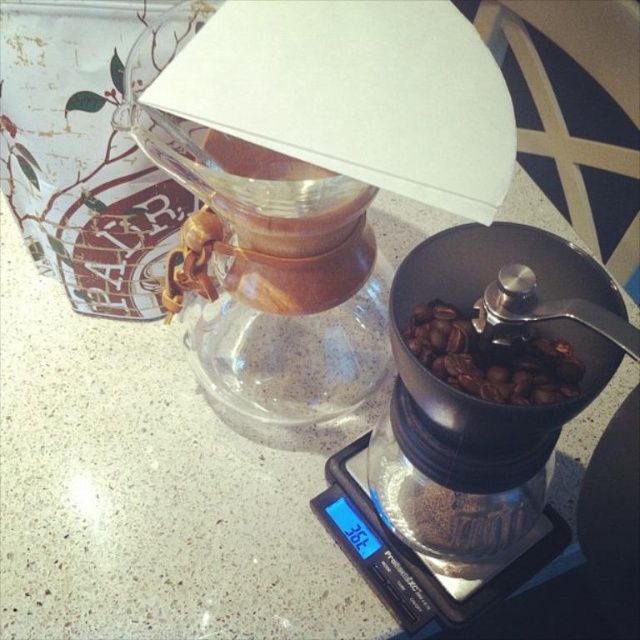
You are setting up a coffee station and need to place the transparent glass carafe at upper center and the black matte coffee grinder at center. According to the image, which object is placed above the other?

The transparent glass carafe at upper center is positioned over the black matte coffee grinder at center, meaning it is placed above the grinder.

You are a photographer holding a camera and want to capture a closeup of the transparent glass carafe at upper center. Given that the minimum focusing distance of your camera is 20 centimeters, can you take the photo without moving either the camera or the carafe?

The transparent glass carafe at upper center and camera are 23.11 centimeters apart from each other. Since the minimum focusing distance is 20 centimeters, the camera can focus on the transparent glass carafe at upper center at this distance, so yes, you can take the photo without moving either.